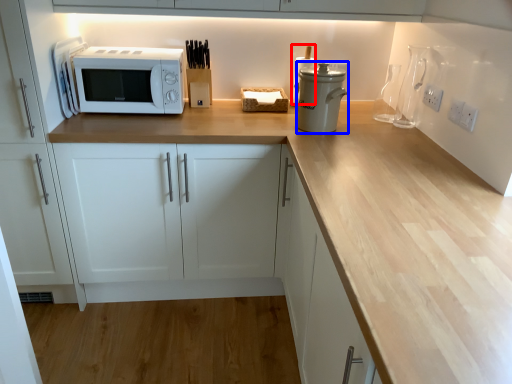
Question: Which of the following is the farthest to the observer, appliance (highlighted by a red box) or appliance (highlighted by a blue box)?

Choices:
 (A) appliance
 (B) appliance

Answer: (A)